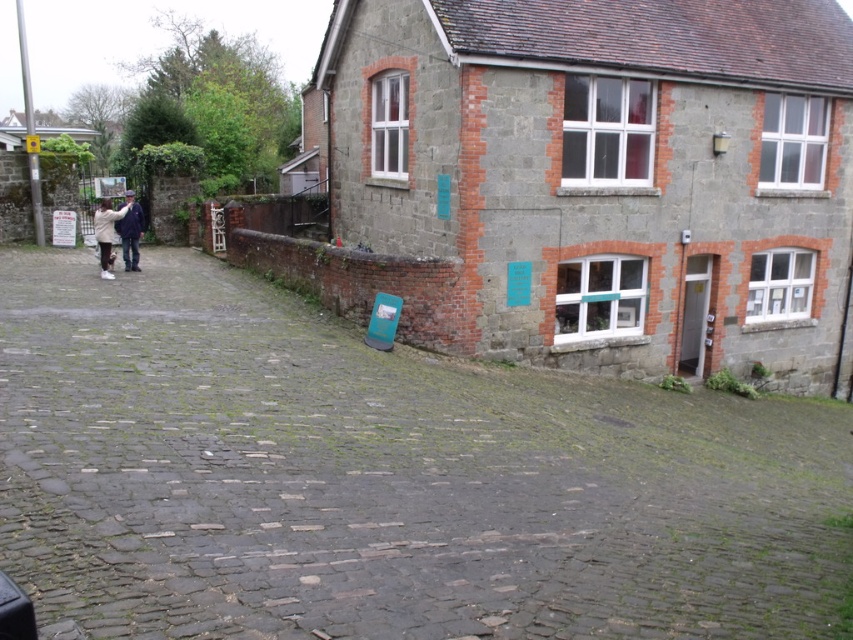
You are a delivery person carrying a large box that is 1.2 meters wide. You need to navigate through the path between the brown cobblestone alley at center and the light brown leather jacket at left. Can your box fit through the space between them?

The brown cobblestone alley at center might be wider than light brown leather jacket at left, so the box that is 1.2 meters wide might fit if the alley is wider. However, since the exact width isn not specified, there is uncertainty.

You are standing at the entrance of the old stone building and want to walk towards the two points marked on the cobblestone pathway. Which point, point (163, 436) or point (103, 273), is closer to you?

Point (163, 436) is closer to you than point (103, 273) because it is nearer in the scene.